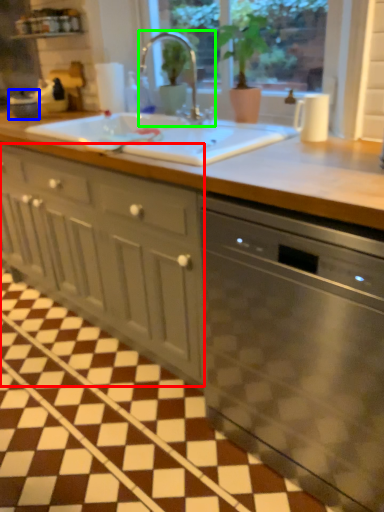
Question: Based on their relative distances, which object is nearer to cabinetry (highlighted by a red box)? Choose from appliance (highlighted by a blue box) and tap (highlighted by a green box).

Choices:
 (A) appliance
 (B) tap

Answer: (B)